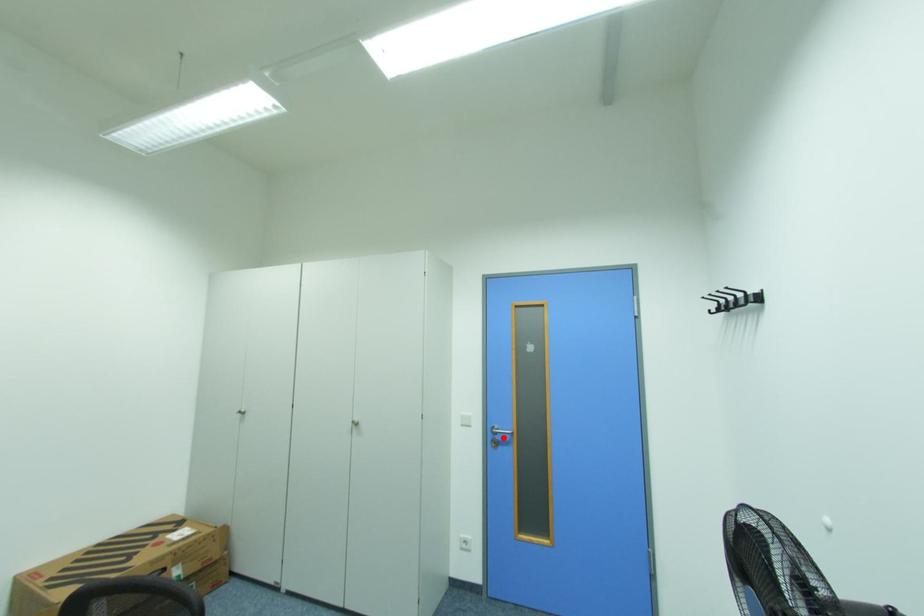
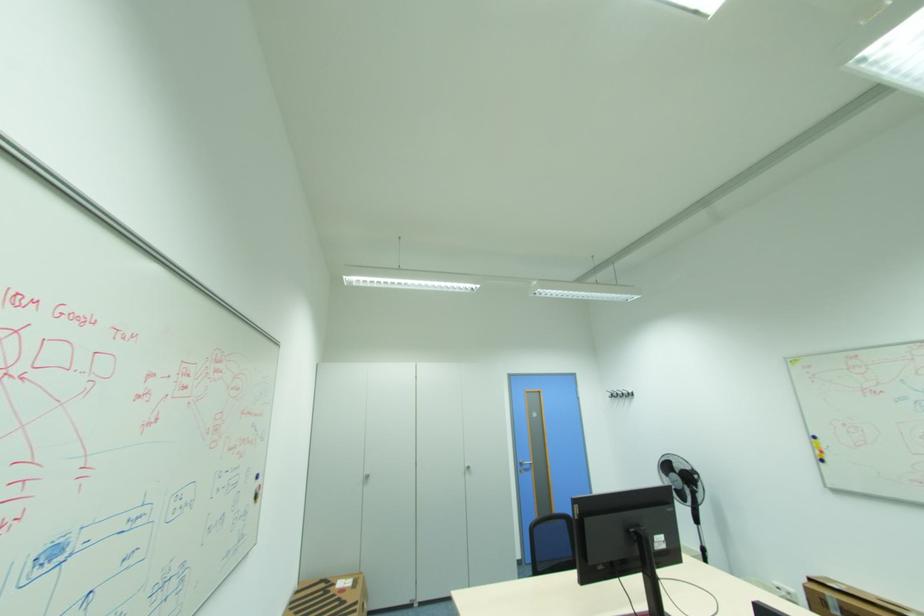
The point at the highlighted location is marked in the first image. Where is the corresponding point in the second image?

(529, 467)